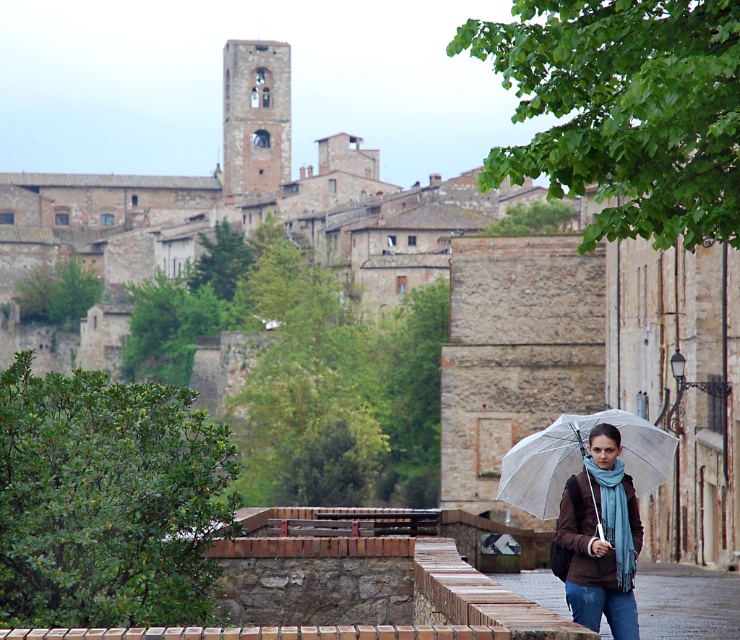
Between brown matte jacket at lower right and transparent plastic umbrella at center, which one appears on the right side from the viewer's perspective?

transparent plastic umbrella at center is more to the right.

Between point (585, 573) and point (645, 452), which one is positioned behind?

Point (645, 452)

In order to click on brown matte jacket at lower right in this screenshot , I will do `click(599, 538)`.

Can you confirm if brown matte jacket at lower right is smaller than smooth stone alley at lower center?

Yes, brown matte jacket at lower right is smaller than smooth stone alley at lower center.

Which is in front, point (615, 483) or point (690, 593)?

Point (615, 483) is more forward.

Find the location of a particular element. This screenshot has height=640, width=740. brown matte jacket at lower right is located at coordinates (599, 538).

Does transparent plastic umbrella at center have a smaller size compared to smooth stone alley at lower center?

Yes.

Is point (622, 410) positioned after point (642, 586)?

Yes, it is.

This screenshot has height=640, width=740. Find the location of `transparent plastic umbrella at center`. transparent plastic umbrella at center is located at coordinates (579, 458).